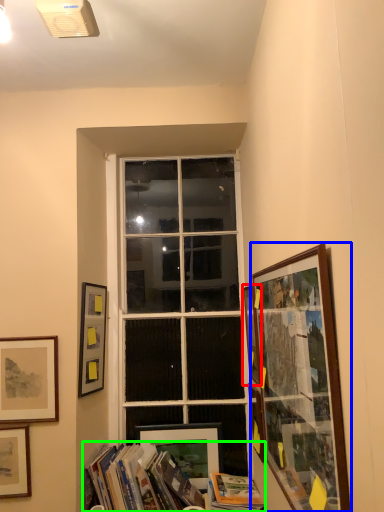
Question: Considering the real-world distances, which object is closest to picture frame (highlighted by a red box)? picture frame (highlighted by a blue box) or book (highlighted by a green box).

Choices:
 (A) picture frame
 (B) book

Answer: (A)